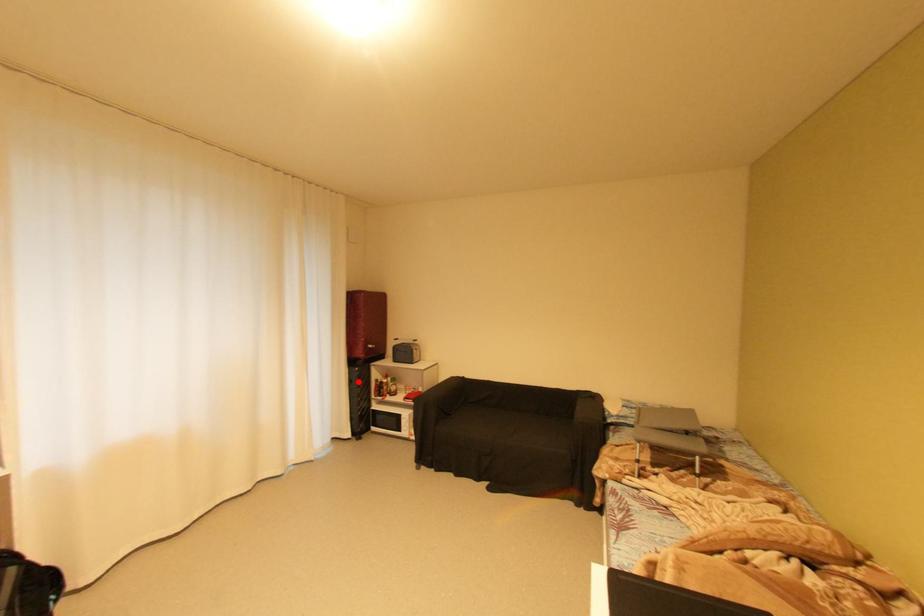
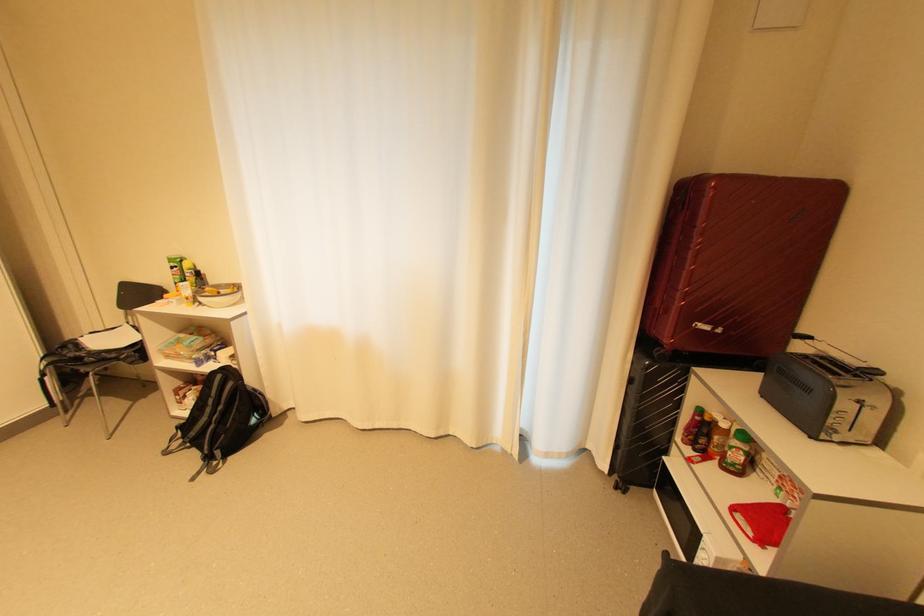
Find the pixel in the second image that matches the highlighted location in the first image.

(638, 381)